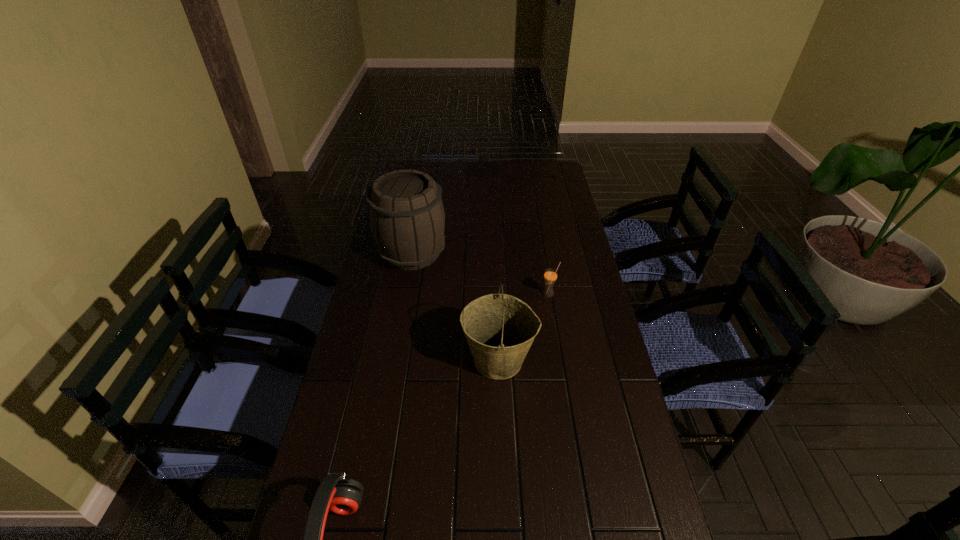
The image size is (960, 540). Find the location of `object located in the right edge section of the desktop`. object located in the right edge section of the desktop is located at coordinates (550, 276).

Locate an element on the screen. The width and height of the screenshot is (960, 540). free space at the far edge of the desktop is located at coordinates 454,168.

Locate an element on the screen. free space at the left edge of the desktop is located at coordinates (385, 314).

The image size is (960, 540). I want to click on free spot at the right edge of the desktop, so click(574, 219).

Locate an element on the screen. The height and width of the screenshot is (540, 960). vacant region between the rightmost object and the farther wine bucket is located at coordinates click(481, 273).

The width and height of the screenshot is (960, 540). Identify the location of unoccupied area between the nearer wine bucket and the farther wine bucket. (455, 306).

Identify the location of object that ranks as the second closest to the second nearest object. This screenshot has width=960, height=540. (406, 215).

Choose which object is the third nearest neighbor to the farther wine bucket. Please provide its 2D coordinates. Your answer should be formatted as a tuple, i.e. [(x, y)], where the tuple contains the x and y coordinates of a point satisfying the conditions above.

[(338, 493)]